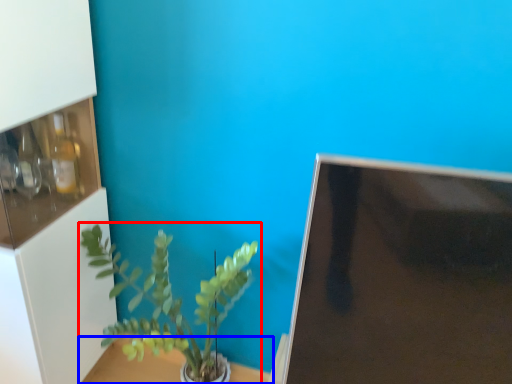
Question: Which object is closer to the camera taking this photo, houseplant (highlighted by a red box) or table (highlighted by a blue box)?

Choices:
 (A) houseplant
 (B) table

Answer: (A)